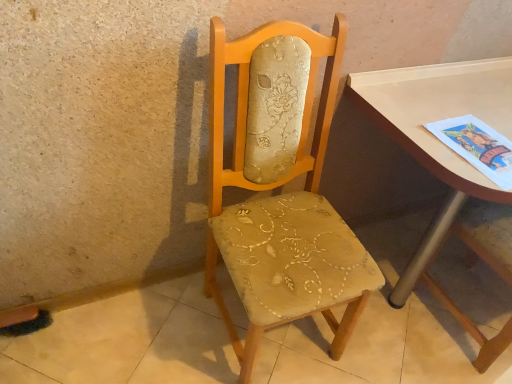
Question: Should I look upward or downward to see matte beige fabric chair at center?

Choices:
 (A) down
 (B) up

Answer: (A)

Question: Is matte beige fabric chair at center thinner than matte white table at right?

Choices:
 (A) no
 (B) yes

Answer: (B)

Question: From the image's perspective, is matte beige fabric chair at center above matte white table at right?

Choices:
 (A) no
 (B) yes

Answer: (A)

Question: Is matte beige fabric chair at center bigger than matte white table at right?

Choices:
 (A) no
 (B) yes

Answer: (A)

Question: Considering the relative positions of matte beige fabric chair at center and matte white table at right in the image provided, is matte beige fabric chair at center to the right of matte white table at right from the viewer's perspective?

Choices:
 (A) yes
 (B) no

Answer: (B)

Question: Is matte beige fabric chair at center located outside matte white table at right?

Choices:
 (A) yes
 (B) no

Answer: (A)

Question: Is the position of matte beige fabric chair at center less distant than that of matte white table at right?

Choices:
 (A) yes
 (B) no

Answer: (A)

Question: Is matte white table at right positioned with its back to matte beige fabric chair at center?

Choices:
 (A) no
 (B) yes

Answer: (A)

Question: Is matte white table at right bigger than matte beige fabric chair at center?

Choices:
 (A) yes
 (B) no

Answer: (A)

Question: Can you confirm if matte white table at right is positioned to the right of matte beige fabric chair at center?

Choices:
 (A) yes
 (B) no

Answer: (A)

Question: Is matte white table at right taller than matte beige fabric chair at center?

Choices:
 (A) yes
 (B) no

Answer: (B)

Question: From a real-world perspective, is matte white table at right physically below matte beige fabric chair at center?

Choices:
 (A) yes
 (B) no

Answer: (A)

Question: Are matte white table at right and matte beige fabric chair at center beside each other?

Choices:
 (A) yes
 (B) no

Answer: (B)

Question: Is beige fabric chair at center far from matte beige fabric chair at center?

Choices:
 (A) no
 (B) yes

Answer: (A)